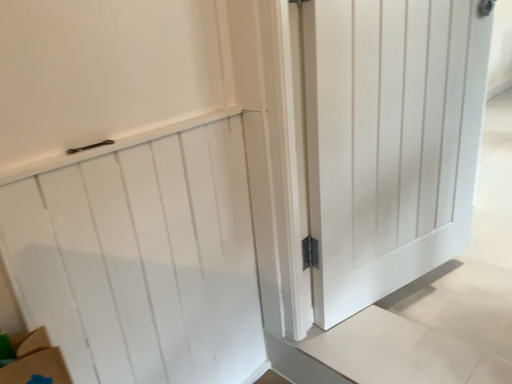
Question: Considering the positions of white wood door at center, which ranks as the 2th door in left-to-right order, and white wood door at upper left, which is the 1th door from left to right, in the image, is white wood door at center, which ranks as the 2th door in left-to-right order, bigger or smaller than white wood door at upper left, which is the 1th door from left to right,?

Choices:
 (A) small
 (B) big

Answer: (B)

Question: From the image's perspective, is white wood door at center, which ranks as the 2th door in left-to-right order, above or below white wood door at upper left, positioned as the second door in right-to-left order?

Choices:
 (A) below
 (B) above

Answer: (B)

Question: Is white wood door at center, which ranks as the 2th door in left-to-right order, in front of or behind white wood door at upper left, which is the 1th door from left to right, in the image?

Choices:
 (A) front
 (B) behind

Answer: (B)

Question: Considering the positions of white wood door at upper left, positioned as the second door in right-to-left order, and white wood door at center, marked as the first door in a right-to-left arrangement, in the image, is white wood door at upper left, positioned as the second door in right-to-left order, taller or shorter than white wood door at center, marked as the first door in a right-to-left arrangement,?

Choices:
 (A) tall
 (B) short

Answer: (B)

Question: From a real-world perspective, is white wood door at upper left, which is the 1th door from left to right, above or below white wood door at center, marked as the first door in a right-to-left arrangement?

Choices:
 (A) above
 (B) below

Answer: (B)

Question: Considering the positions of white wood door at upper left, positioned as the second door in right-to-left order, and white wood door at center, which ranks as the 2th door in left-to-right order, in the image, is white wood door at upper left, positioned as the second door in right-to-left order, wider or thinner than white wood door at center, which ranks as the 2th door in left-to-right order,?

Choices:
 (A) thin
 (B) wide

Answer: (A)

Question: Based on their sizes in the image, would you say white wood door at upper left, which is the 1th door from left to right, is bigger or smaller than white wood door at center, marked as the first door in a right-to-left arrangement?

Choices:
 (A) big
 (B) small

Answer: (B)